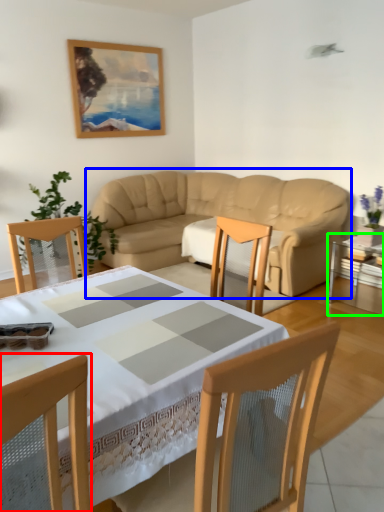
Question: Considering the real-world distances, which object is farthest from chair (highlighted by a red box)? studio couch (highlighted by a blue box) or table (highlighted by a green box)?

Choices:
 (A) studio couch
 (B) table

Answer: (A)